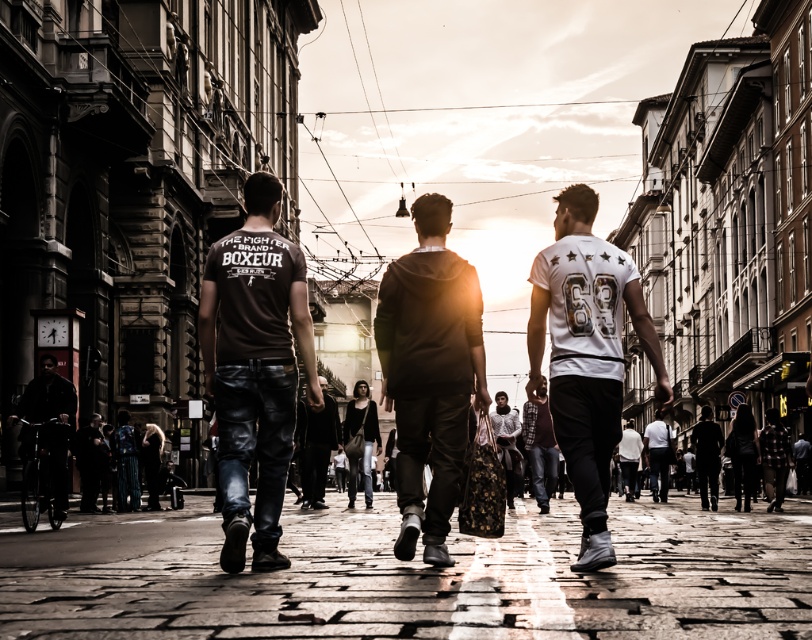
Question: Is dark brown leather jacket at lower left below dark gray suit at lower right?

Choices:
 (A) yes
 (B) no

Answer: (B)

Question: Considering the real-world distances, which object is closest to the dark brown hoodie at center?

Choices:
 (A) dark matte jacket at left
 (B) white matte jersey at center
 (C) matte brown leather jacket at center
 (D) white jersey at center

Answer: (B)

Question: Can you confirm if white matte jersey at center is positioned to the left of dark brown leather jacket at lower left?

Choices:
 (A) no
 (B) yes

Answer: (A)

Question: Which of these objects is positioned closest to the dark brown leather jacket at lower left?

Choices:
 (A) white textured sweater at center
 (B) dark brown leather pants at center
 (C) leather pants at center

Answer: (C)

Question: Which of the following is the farthest from the observer?

Choices:
 (A) dark brown hoodie at center
 (B) dark matte jacket at left
 (C) white matte jersey at center
 (D) dark brown leather jacket at lower left

Answer: (D)

Question: Does white matte jersey at center have a greater width compared to dark gray suit at lower right?

Choices:
 (A) yes
 (B) no

Answer: (A)